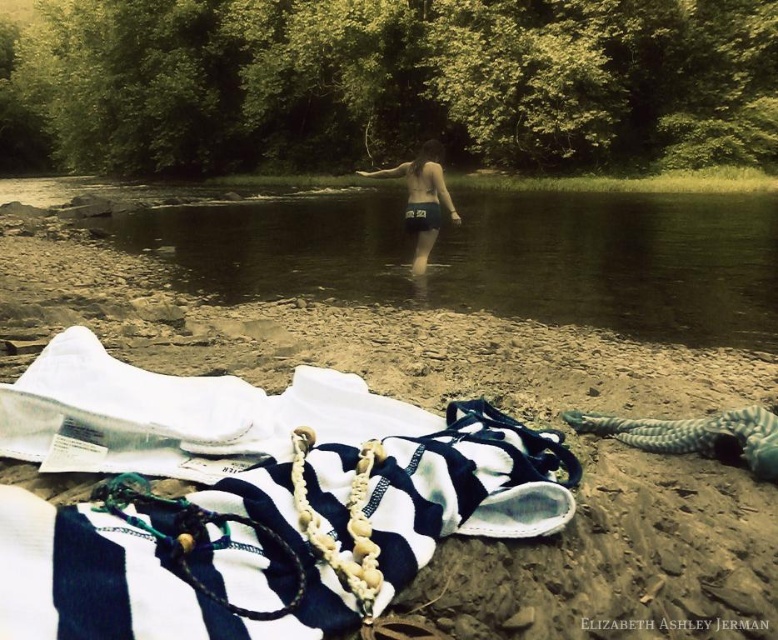
Question: Among these objects, which one is farthest from the camera?

Choices:
 (A) white fabric at lower left
 (B) dark blue fabric shorts at center

Answer: (B)

Question: Can you confirm if white fabric at lower left is bigger than dark blue fabric shorts at center?

Choices:
 (A) yes
 (B) no

Answer: (B)

Question: Which of the following is the farthest from the observer?

Choices:
 (A) clear water at center
 (B) white fabric at lower left
 (C) dark blue fabric shorts at center

Answer: (C)

Question: Does clear water at center have a larger size compared to dark blue fabric shorts at center?

Choices:
 (A) yes
 (B) no

Answer: (A)

Question: Does white fabric at lower left come in front of clear water at center?

Choices:
 (A) yes
 (B) no

Answer: (A)

Question: Which of the following is the farthest from the observer?

Choices:
 (A) (419, 218)
 (B) (513, 611)
 (C) (766, 272)

Answer: (A)